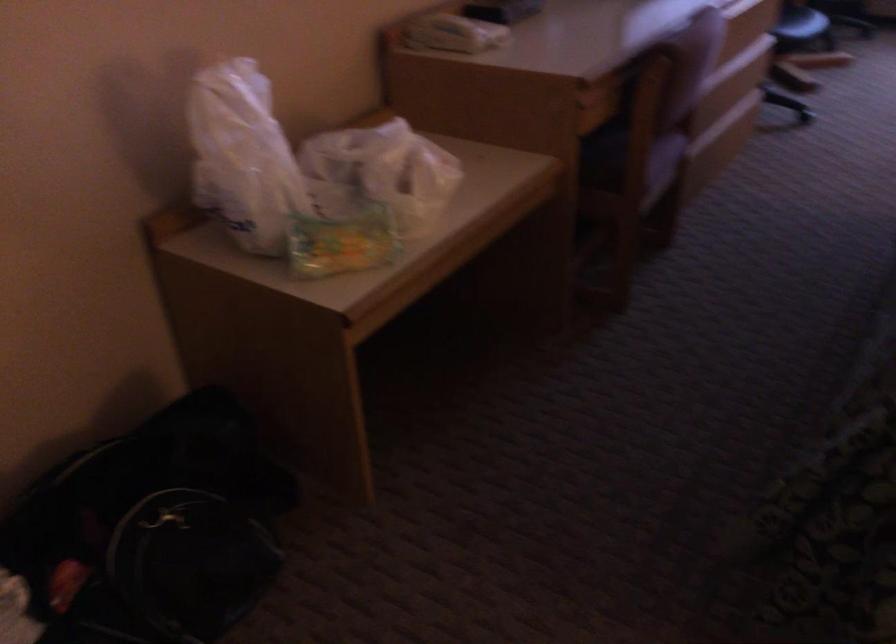
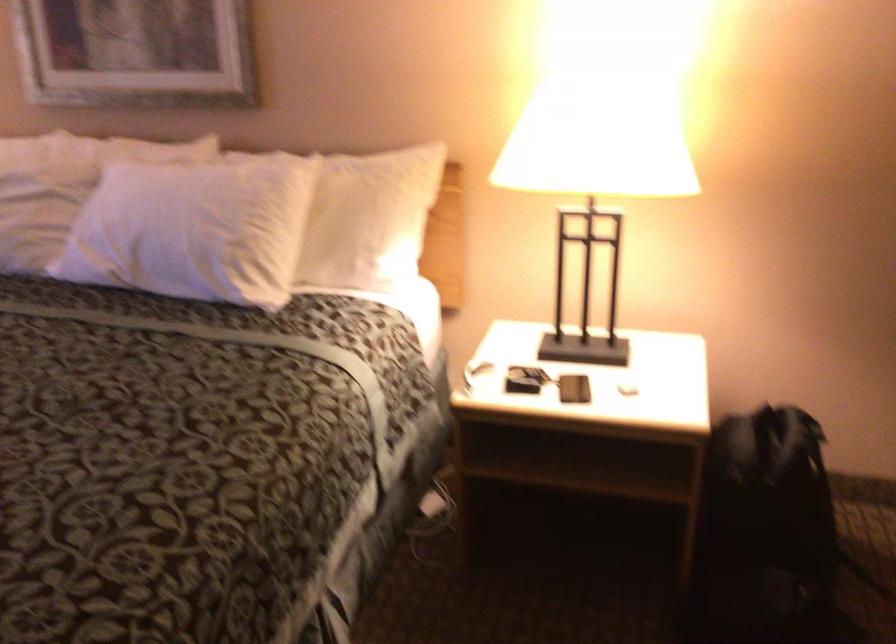
First-person continuous shooting, in which direction is the camera rotating?

The camera rotated toward right-down.